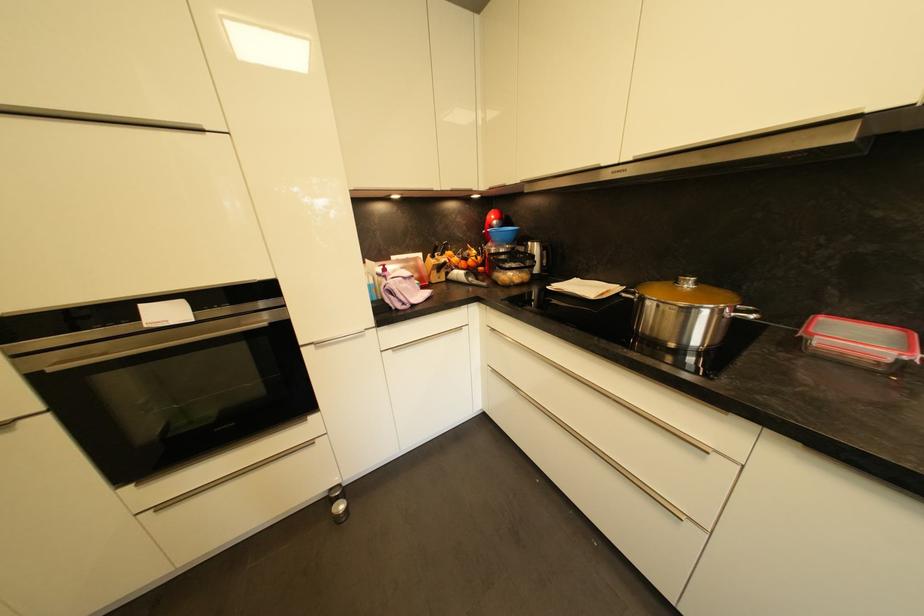
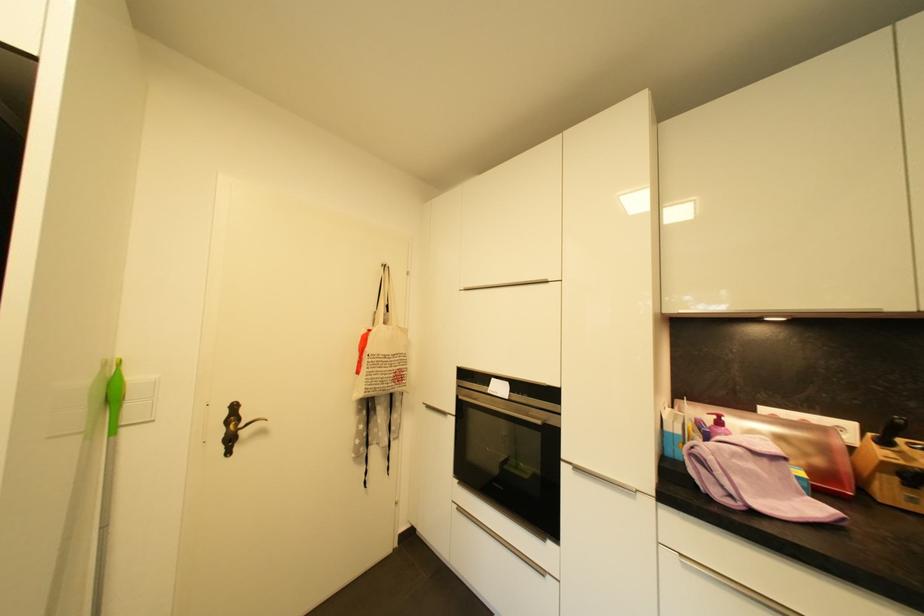
In the second image, find the point that corresponds to point 438,257 in the first image.

(890, 445)